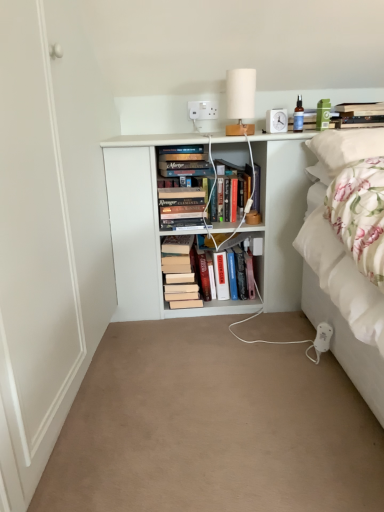
Question: Which is correct: white fabric lampshade at upper center is inside hardcover book at upper right, marked as the third book in a left-to-right arrangement, or outside of it?

Choices:
 (A) outside
 (B) inside

Answer: (A)

Question: From the image's perspective, relative to hardcover book at upper right, marked as the third book in a left-to-right arrangement, is white fabric lampshade at upper center above or below?

Choices:
 (A) above
 (B) below

Answer: (B)

Question: Which object is positioned closest to the white plastic socket at upper center?

Choices:
 (A) white soft pillow at upper right
 (B) white fabric lampshade at upper center
 (C) white matte bookshelf at center
 (D) hardcover book at center, the second book in the top-to-bottom sequence
 (E) beige carpet at center

Answer: (B)

Question: Which is farther from the beige carpet at center?

Choices:
 (A) hardcover book at center, which ranks as the second book in right-to-left order
 (B) white fabric lampshade at upper center
 (C) white plastic socket at upper center
 (D) hardcover book at upper right, the third book from the bottom
 (E) hardcover books at center, which ranks as the first book in left-to-right order

Answer: (C)